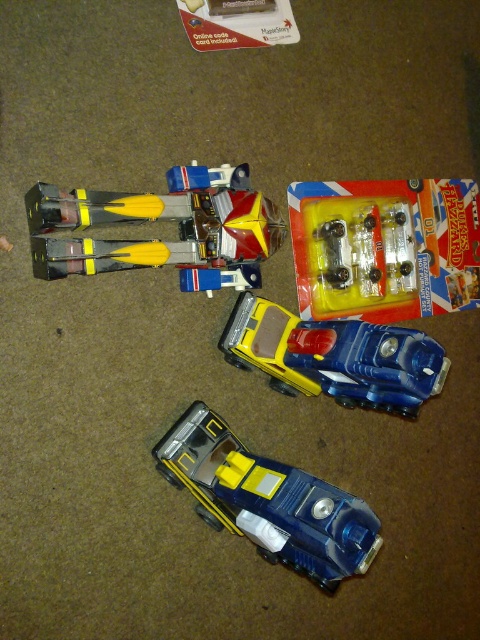
Where is `clear plastic car at upper center`? clear plastic car at upper center is located at coordinates (384, 248).

Is point (299, 180) behind point (35, 248)?

Yes, point (299, 180) is behind point (35, 248).

Which is behind, point (347, 189) or point (232, 225)?

Positioned behind is point (347, 189).

The image size is (480, 640). Find the location of `clear plastic car at upper center`. clear plastic car at upper center is located at coordinates (384, 248).

In the scene shown: Is clear plastic car at upper center smaller than yellow matte truck at upper center?

No, clear plastic car at upper center is not smaller than yellow matte truck at upper center.

Is point (396, 218) positioned before point (308, 358)?

No.

Find the location of a particular element. The image size is (480, 640). clear plastic car at upper center is located at coordinates (384, 248).

Who is more distant from viewer, (263, 221) or (425, 371)?

Positioned behind is point (263, 221).

Can you confirm if shiny plastic robot at center is positioned below yellow matte truck at upper center?

No.

Does point (235, 259) lie behind point (350, 380)?

That is True.

At what (x,y) coordinates should I click in order to perform the action: click on shiny plastic robot at center. Please return your answer as a coordinate pair (x, y). The width and height of the screenshot is (480, 640). Looking at the image, I should click on (152, 220).